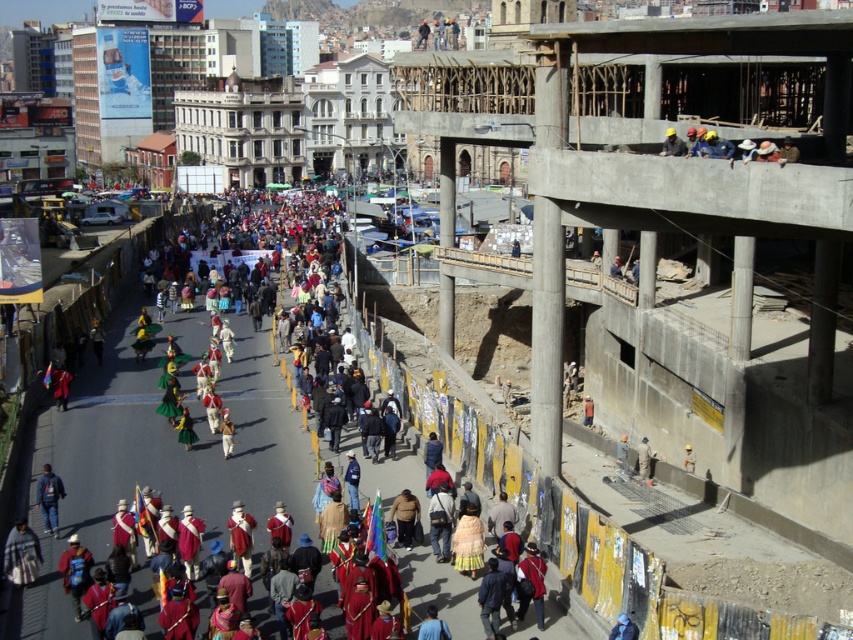
You are a photographer trying to capture the parade participants. You notice the red fabric costumes at center and the dark blue backpack at lower left. Which object should you focus on to ensure both are in the frame without moving the camera?

You should focus on the red fabric costumes at center because it is positioned to the left of the dark blue backpack at lower left, so keeping the center object in focus will help include both in the frame.

You are standing at the construction site on the right side of the street. You want to walk to a point that is exactly 40 meters away from you. Is the point at coordinate point (x=665, y=147) within that distance range?

The distance of point (x=665, y=147) from viewer is 40.89 meters, so the point is slightly beyond the 40 meters range. You would need to move a bit closer to reach the desired distance.